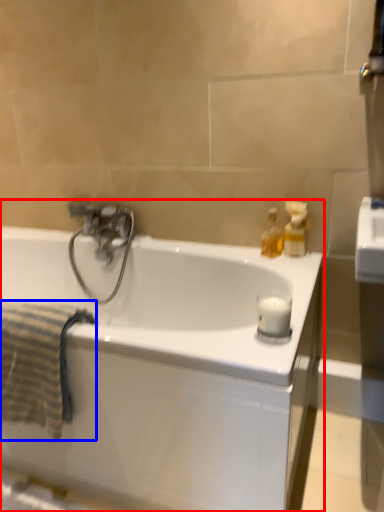
Question: Among these objects, which one is nearest to the camera, bathtub (highlighted by a red box) or bath towel (highlighted by a blue box)?

Choices:
 (A) bathtub
 (B) bath towel

Answer: (A)